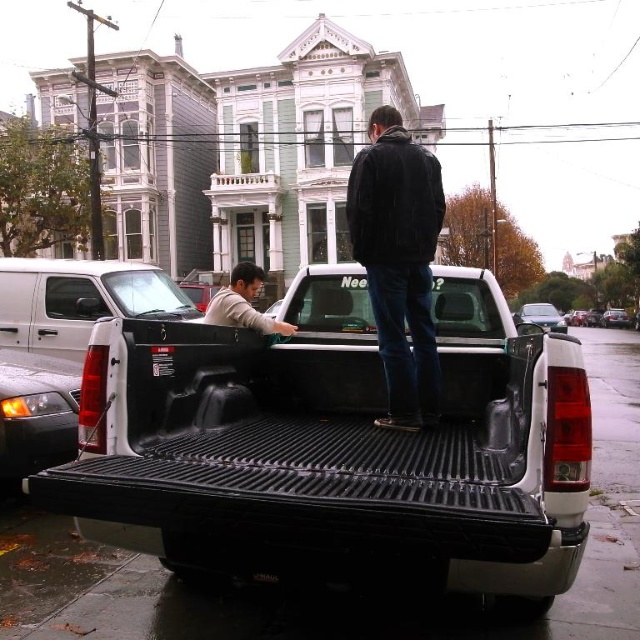
Question: Which object appears farthest from the camera in this image?

Choices:
 (A) gray matte shirt at center
 (B) dark blue jeans at center
 (C) black textured truck bed at center
 (D) white matte truck bed at center

Answer: (D)

Question: Can you confirm if white matte truck bed at center is wider than gray matte shirt at center?

Choices:
 (A) yes
 (B) no

Answer: (B)

Question: Does black textured truck bed at center have a smaller size compared to gray matte shirt at center?

Choices:
 (A) no
 (B) yes

Answer: (B)

Question: Which point appears farthest from the camera in this image?

Choices:
 (A) (228, 406)
 (B) (38, 273)

Answer: (B)

Question: In this image, where is black textured truck bed at center located relative to dark blue jeans at center?

Choices:
 (A) above
 (B) below

Answer: (B)

Question: Which object appears farthest from the camera in this image?

Choices:
 (A) dark blue jeans at center
 (B) white matte truck bed at center
 (C) black textured truck bed at center

Answer: (B)